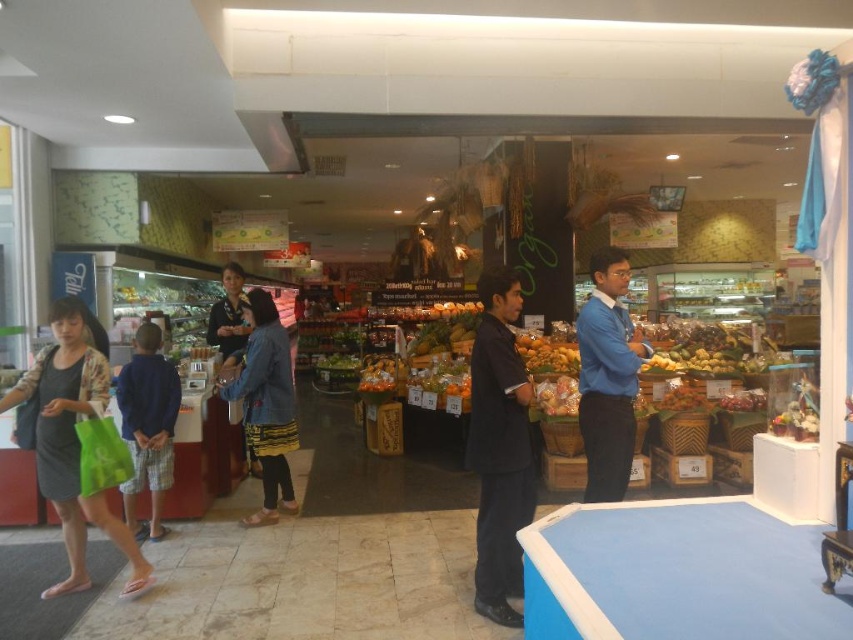
Between point (128, 582) and point (276, 384), which one is positioned in front?

Point (128, 582) is more forward.

Where is `matte green bag at lower left`? matte green bag at lower left is located at coordinates (73, 440).

Measure the distance between black matte shirt at center and denim jacket at center.

black matte shirt at center and denim jacket at center are 2.03 meters apart.

Between point (492, 328) and point (282, 461), which one is positioned behind?

Positioned behind is point (282, 461).

Locate an element on the screen. black matte shirt at center is located at coordinates (498, 448).

Can you confirm if matte green bag at lower left is bigger than blue smooth shirt at center?

Indeed, matte green bag at lower left has a larger size compared to blue smooth shirt at center.

Between matte green bag at lower left and blue smooth shirt at center, which one is positioned higher?

blue smooth shirt at center is higher up.

Identify the location of matte green bag at lower left. (73, 440).